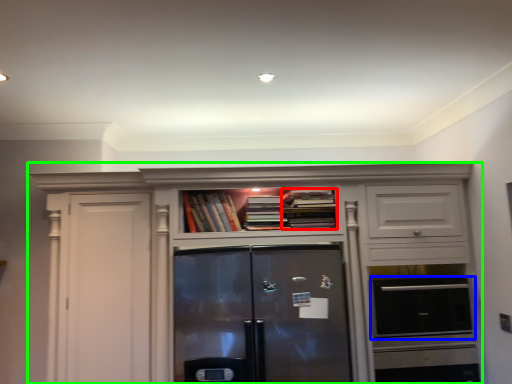
Question: Which is nearer to the book (highlighted by a red box)? appliance (highlighted by a blue box) or cabinetry (highlighted by a green box).

Choices:
 (A) appliance
 (B) cabinetry

Answer: (B)